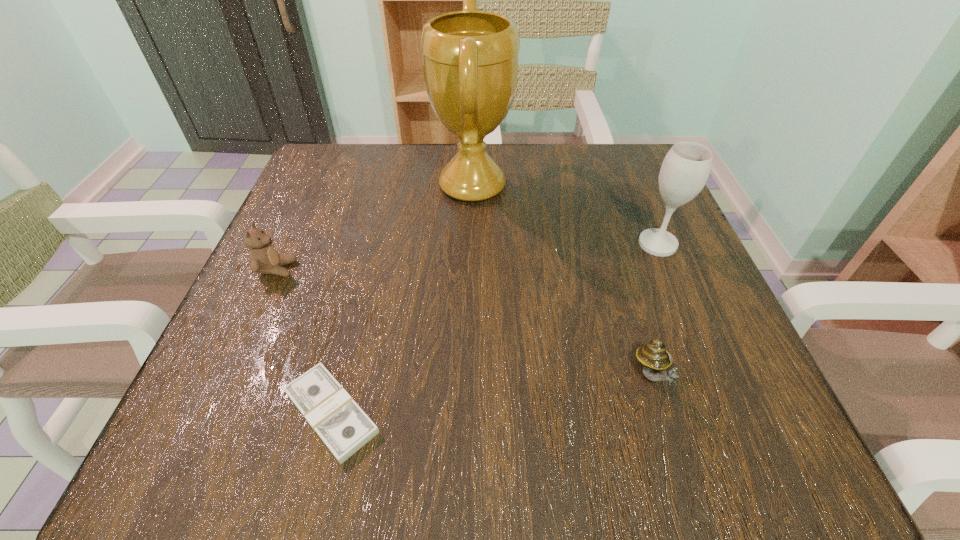
Image resolution: width=960 pixels, height=540 pixels. Find the location of `object present at the near right corner`. object present at the near right corner is located at coordinates (654, 358).

You are a GUI agent. You are given a task and a screenshot of the screen. Output one action in this format:
    pyautogui.click(x=<x>, y=<y>)
    Task: Click on the vacant space at the near edge
    
    Given the screenshot: What is the action you would take?
    pyautogui.click(x=540, y=448)

Where is `vacant area at the left edge of the desktop`? vacant area at the left edge of the desktop is located at coordinates (340, 221).

This screenshot has width=960, height=540. I want to click on vacant area at the right edge of the desktop, so click(x=625, y=207).

The image size is (960, 540). In order to click on free space at the far left corner in this screenshot , I will do `click(372, 157)`.

This screenshot has height=540, width=960. I want to click on free spot at the near left corner of the desktop, so click(168, 449).

At what (x,y) coordinates should I click in order to perform the action: click on free space at the far right corner. Please return your answer as a coordinate pair (x, y). Looking at the image, I should click on (635, 200).

Where is `blank space at the near right corner of the desktop`? blank space at the near right corner of the desktop is located at coordinates (718, 421).

Where is `vacant area between the snail and the shortest object`? The width and height of the screenshot is (960, 540). vacant area between the snail and the shortest object is located at coordinates (492, 394).

This screenshot has height=540, width=960. Find the location of `free area in between the third object from left to right and the fourth shortest object`. free area in between the third object from left to right and the fourth shortest object is located at coordinates (565, 214).